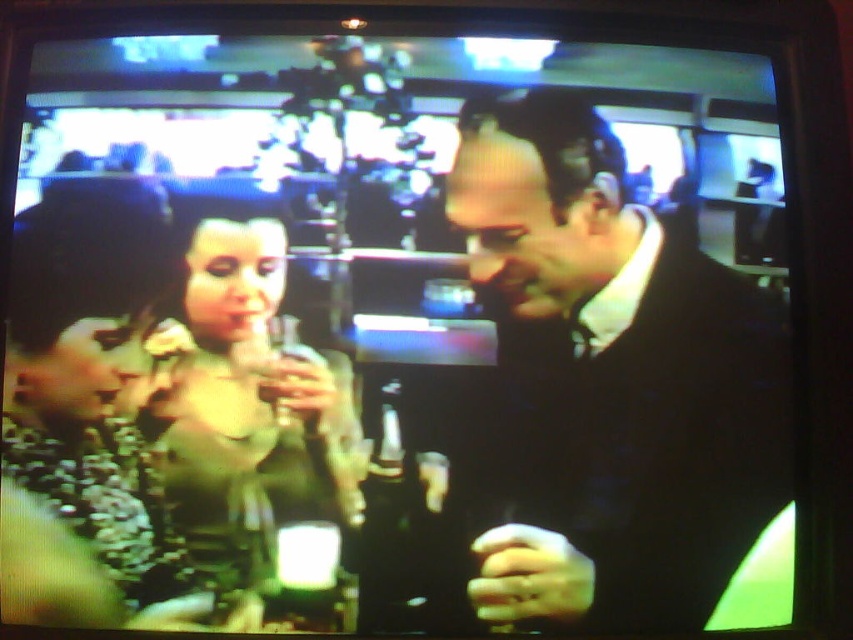
Based on the photo, you are at a party and want to find the matte green dress at center. Where should you look?

You should look at point (245, 394) to find the matte green dress at center.

In the scene, there is a man wearing a dark wool suit at center. If you were standing at the point marked by coordinates point [613,380], which object would you be closest to?

You would be closest to the dark wool suit at center, as the coordinates point [613,380] represent its location.

You are a photographer at a party and need to capture a photo of both the dark wool suit at center and the matte green dress at center. From the perspective of someone standing behind the photographer, which object is positioned to the left?

The matte green dress at center is positioned to the left of the dark wool suit at center.